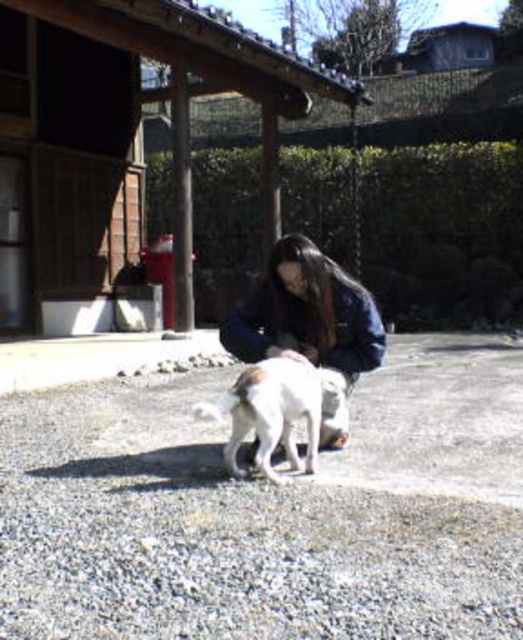
The width and height of the screenshot is (523, 640). Describe the element at coordinates (268, 513) in the screenshot. I see `gray gravel at center` at that location.

Image resolution: width=523 pixels, height=640 pixels. Find the location of `gray gravel at center`. gray gravel at center is located at coordinates (268, 513).

Identify the location of gray gravel at center. (268, 513).

Can you confirm if dark blue denim jacket at center is thinner than white fur dog at center?

In fact, dark blue denim jacket at center might be wider than white fur dog at center.

Is dark blue denim jacket at center shorter than white fur dog at center?

In fact, dark blue denim jacket at center may be taller than white fur dog at center.

You are a GUI agent. You are given a task and a screenshot of the screen. Output one action in this format:
    pyautogui.click(x=<x>, y=<y>)
    Task: Click on the dark blue denim jacket at center
    
    Given the screenshot: What is the action you would take?
    pyautogui.click(x=306, y=314)

Does gray gravel at center appear under dark blue denim jacket at center?

Correct, gray gravel at center is located below dark blue denim jacket at center.

At what (x,y) coordinates should I click in order to perform the action: click on gray gravel at center. Please return your answer as a coordinate pair (x, y). The image size is (523, 640). Looking at the image, I should click on (268, 513).

Where is `gray gravel at center`? gray gravel at center is located at coordinates (268, 513).